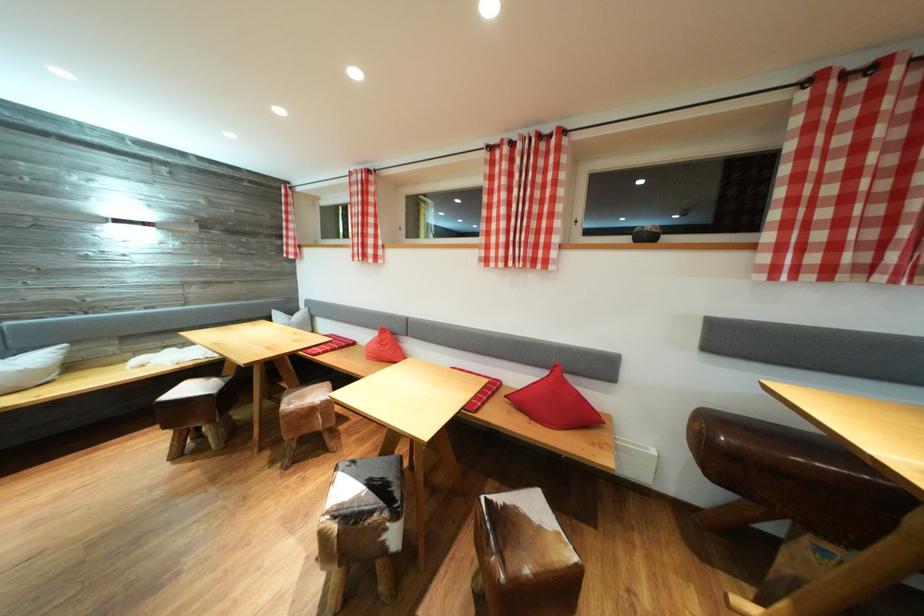
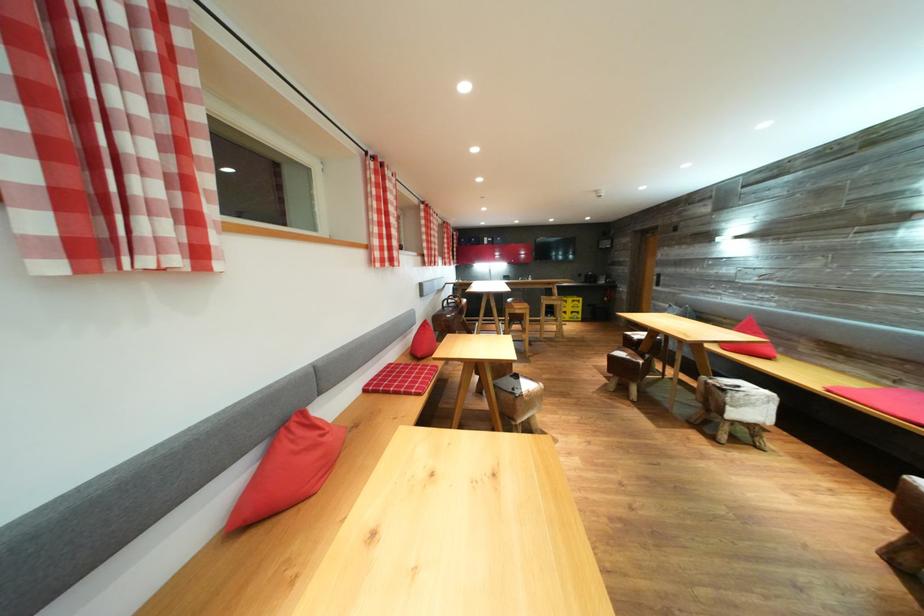
Question: I am providing you with two images of the same scene from different viewpoints. Which of the following objects are not visible in image2?

Choices:
 (A) yellow plastic crate
 (B) cowhide stool seat
 (C) pink seat cushion
 (D) grey tin

Answer: (B)